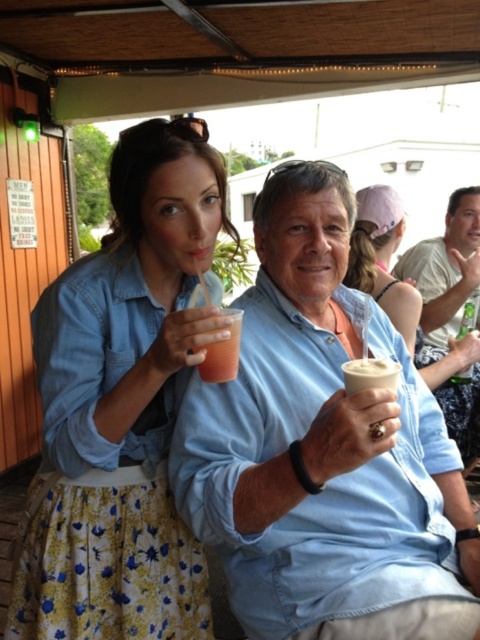
Does translucent plastic cup at center appear on the right side of white creamy cup at center?

No, translucent plastic cup at center is not to the right of white creamy cup at center.

Which is below, translucent plastic cup at center or white creamy cup at center?

white creamy cup at center is below.

Find the location of `translucent plastic cup at center`. translucent plastic cup at center is located at coordinates pyautogui.click(x=223, y=353).

This screenshot has width=480, height=640. Find the location of `translucent plastic cup at center`. translucent plastic cup at center is located at coordinates (223, 353).

Does point (448, 278) come in front of point (347, 376)?

No, it is not.

Where is `matte blue shirt at center`? The image size is (480, 640). matte blue shirt at center is located at coordinates (450, 316).

The width and height of the screenshot is (480, 640). I want to click on matte blue shirt at center, so click(x=450, y=316).

Does matte blue shirt at center have a greater height compared to translucent plastic cup at center?

Correct, matte blue shirt at center is much taller as translucent plastic cup at center.

Is point (420, 285) positioned before point (213, 369)?

That is False.

Locate an element on the screen. matte blue shirt at center is located at coordinates (450, 316).